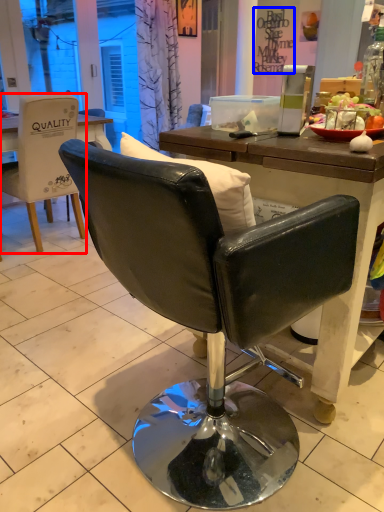
Question: Which of the following is the closest to the observer, chair (highlighted by a red box) or writing (highlighted by a blue box)?

Choices:
 (A) chair
 (B) writing

Answer: (A)